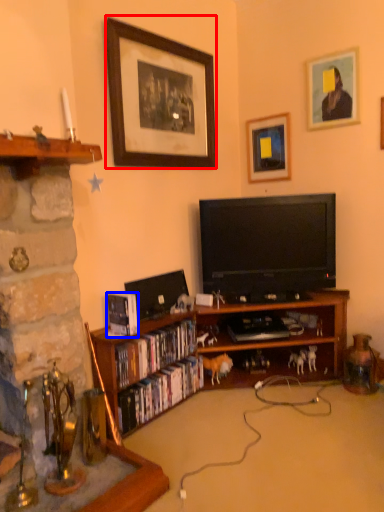
Question: Which object is closer to the camera taking this photo, picture frame (highlighted by a red box) or book (highlighted by a blue box)?

Choices:
 (A) picture frame
 (B) book

Answer: (B)